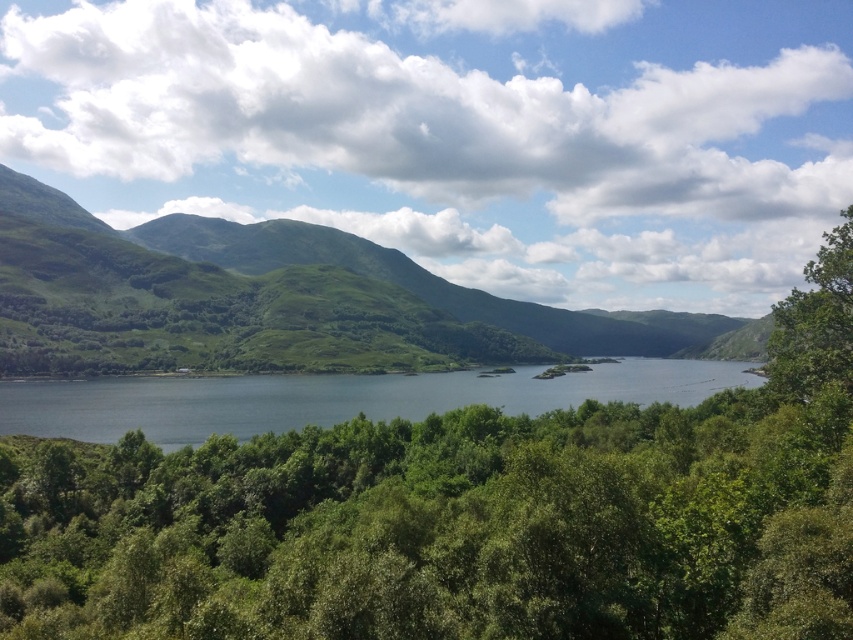
Is green leafy trees at center closer to the viewer compared to blue water at center?

Yes, it is.

Can you confirm if green leafy trees at center is bigger than blue water at center?

No.

Locate an element on the screen. green leafy trees at center is located at coordinates (445, 528).

Who is positioned more to the left, green grassy hill at center or green leafy tree at right?

green grassy hill at center is more to the left.

Between point (171, 356) and point (802, 320), which one is positioned behind?

Point (171, 356)

Locate an element on the screen. The width and height of the screenshot is (853, 640). green grassy hill at center is located at coordinates (268, 300).

Does green leafy trees at center come behind green leafy tree at right?

That is False.

Between green leafy trees at center and green leafy tree at right, which one is positioned lower?

green leafy trees at center is below.

Where is `green leafy trees at center`? This screenshot has width=853, height=640. green leafy trees at center is located at coordinates (445, 528).